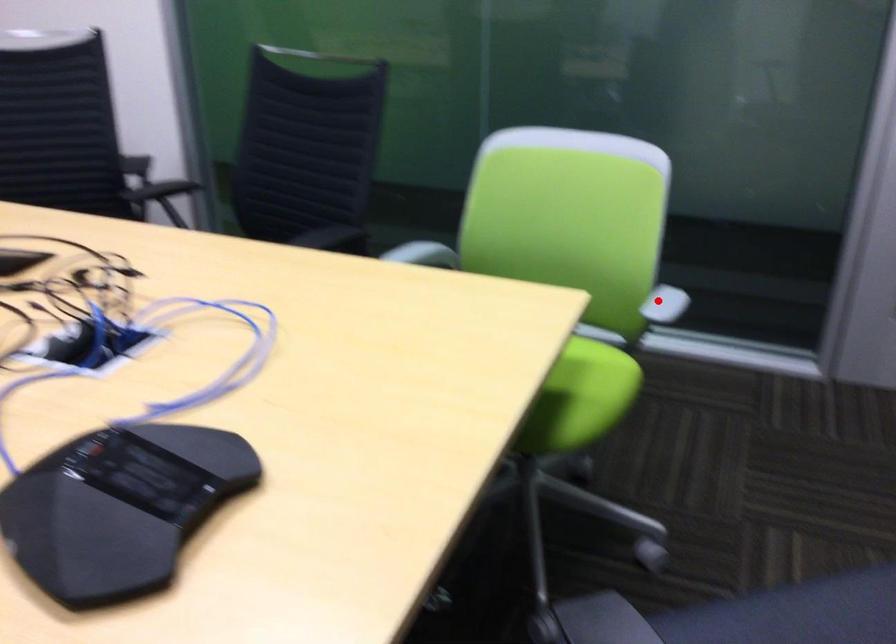
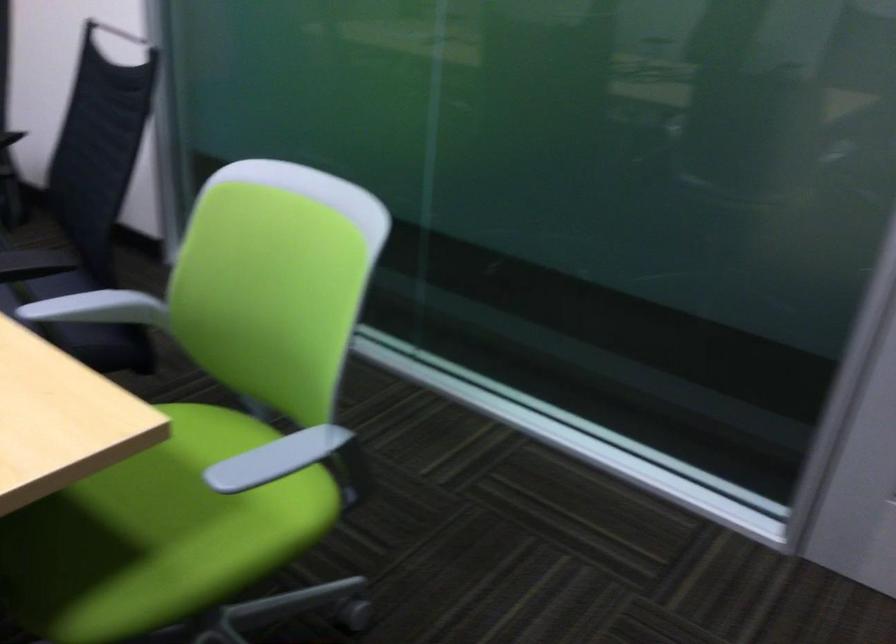
Question: I am providing you with two images of the same scene from different viewpoints. Given a red point in image1, look at the same physical point in image2. Is it:

Choices:
 (A) Closer to the viewpoint
 (B) Farther from the viewpoint

Answer: (A)